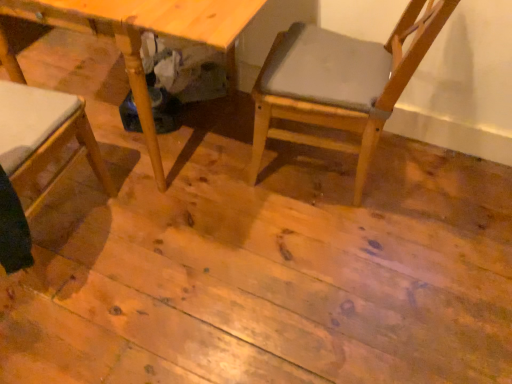
You are a GUI agent. You are given a task and a screenshot of the screen. Output one action in this format:
    pyautogui.click(x=<x>, y=<y>)
    Task: Click on the free space in front of light brown wood chair at center
    
    Given the screenshot: What is the action you would take?
    pyautogui.click(x=313, y=249)